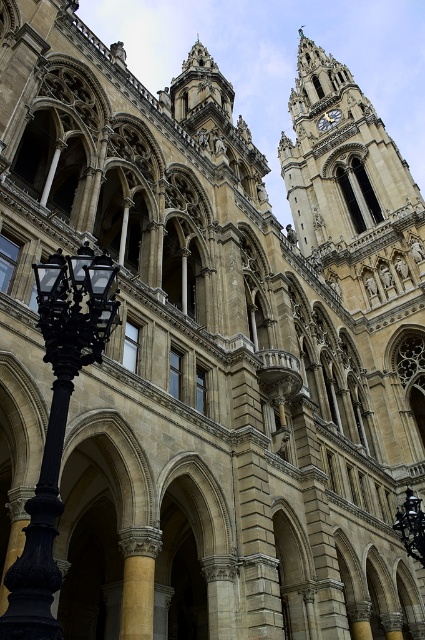
The height and width of the screenshot is (640, 425). Find the location of `stone clock tower at upper right`. stone clock tower at upper right is located at coordinates (350, 186).

Is stone clock tower at upper right smaller than black wrought iron streetlight at left?

No, stone clock tower at upper right is not smaller than black wrought iron streetlight at left.

Identify the location of stone clock tower at upper right. (350, 186).

Does point (283, 170) come farther from viewer compared to point (336, 120)?

That is False.

Does point (322, 248) come closer to viewer compared to point (328, 122)?

Yes, point (322, 248) is closer to viewer.

This screenshot has height=640, width=425. In order to click on stone clock tower at upper right in this screenshot , I will do `click(350, 186)`.

Can you confirm if black wrought iron streetlight at left is positioned below gold metallic clock at upper center?

Yes, black wrought iron streetlight at left is below gold metallic clock at upper center.

Between black wrought iron streetlight at left and gold metallic clock at upper center, which one has more height?

black wrought iron streetlight at left

Find the location of a particular element. This screenshot has height=640, width=425. black wrought iron streetlight at left is located at coordinates (57, 424).